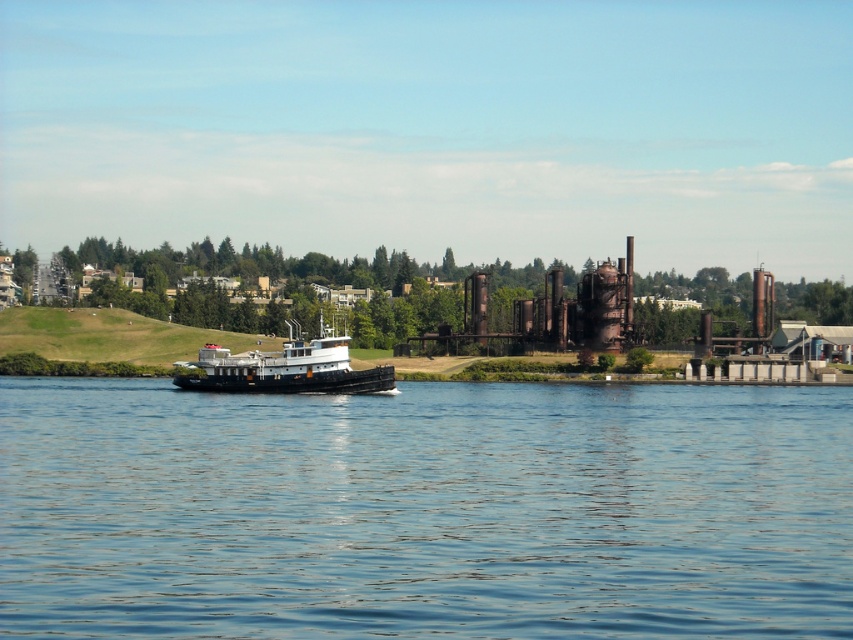
Question: Is the position of blue water at center more distant than that of black matte tugboat at center?

Choices:
 (A) yes
 (B) no

Answer: (B)

Question: Observing the image, what is the correct spatial positioning of blue water at center in reference to black matte tugboat at center?

Choices:
 (A) right
 (B) left

Answer: (A)

Question: Which point appears closest to the camera in this image?

Choices:
 (A) (215, 348)
 (B) (833, 513)

Answer: (B)

Question: Is blue water at center thinner than black matte tugboat at center?

Choices:
 (A) no
 (B) yes

Answer: (A)